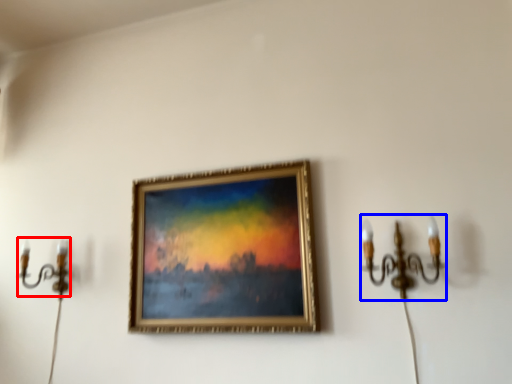
Question: Among these objects, which one is farthest to the camera, candle holder (highlighted by a red box) or candle holder (highlighted by a blue box)?

Choices:
 (A) candle holder
 (B) candle holder

Answer: (A)